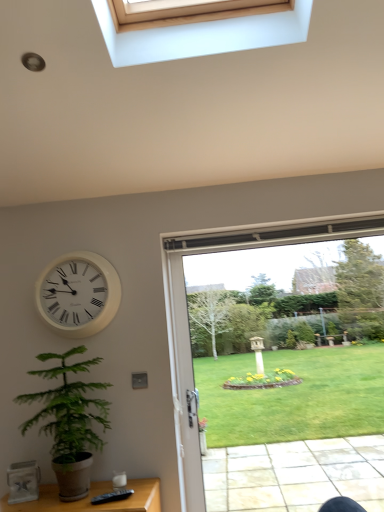
Where is `green leafy plant at lower left`? Image resolution: width=384 pixels, height=512 pixels. green leafy plant at lower left is located at coordinates (69, 421).

Based on the photo, what is the approximate height of white plastic clock at upper left?

It is 18.72 inches.

This screenshot has width=384, height=512. In order to click on green leafy plant at lower left in this screenshot , I will do `click(69, 421)`.

Is clear glass door at center a part of green leafy plant at lower left?

No, clear glass door at center is not inside green leafy plant at lower left.

Between green leafy plant at lower left and clear glass door at center, which one is positioned behind?

clear glass door at center is further from the camera.

Who is shorter, green leafy plant at lower left or clear glass door at center?

green leafy plant at lower left.

From a real-world perspective, is green leafy plant at lower left below clear glass door at center?

Indeed, from a real-world perspective, green leafy plant at lower left is positioned beneath clear glass door at center.

Considering the positions of objects clear glass door at center and green leafy plant at lower left in the image provided, who is more to the right, clear glass door at center or green leafy plant at lower left?

From the viewer's perspective, clear glass door at center appears more on the right side.

Would you consider clear glass door at center to be distant from green leafy plant at lower left?

clear glass door at center is near green leafy plant at lower left, not far away.

Is clear glass door at center facing towards green leafy plant at lower left?

No.

What's the angular difference between clear glass door at center and green leafy plant at lower left's facing directions?

The facing directions of clear glass door at center and green leafy plant at lower left are 1.2 degrees apart.

Considering the relative sizes of green leafy plant at lower left and white plastic clock at upper left in the image provided, is green leafy plant at lower left shorter than white plastic clock at upper left?

No, green leafy plant at lower left is not shorter than white plastic clock at upper left.

Is green leafy plant at lower left placed right next to white plastic clock at upper left?

No, green leafy plant at lower left is not beside white plastic clock at upper left.

In the scene shown: Is green leafy plant at lower left completely or partially outside of white plastic clock at upper left?

green leafy plant at lower left is positioned outside white plastic clock at upper left.

In terms of width, does green leafy plant at lower left look wider or thinner when compared to white plastic clock at upper left?

In the image, green leafy plant at lower left appears to be wider than white plastic clock at upper left.

In the scene shown: From a real-world perspective, is white plastic clock at upper left physically located above or below clear glass door at center?

Clearly, from a real-world perspective, white plastic clock at upper left is above clear glass door at center.

The image size is (384, 512). Find the location of `window in front of the white plastic clock at upper left`. window in front of the white plastic clock at upper left is located at coordinates (186, 312).

Considering the sizes of white plastic clock at upper left and clear glass door at center in the image, is white plastic clock at upper left wider or thinner than clear glass door at center?

In the image, white plastic clock at upper left appears to be wider than clear glass door at center.

Which is more to the left, white plastic clock at upper left or clear glass door at center?

white plastic clock at upper left is more to the left.

How much distance is there between white plastic clock at upper left and green leafy plant at lower left?

14.63 inches.

Can you tell me how much white plastic clock at upper left and green leafy plant at lower left differ in facing direction?

The angular difference between white plastic clock at upper left and green leafy plant at lower left is 1.8 degrees.

Is green leafy plant at lower left at the back of white plastic clock at upper left?

No, white plastic clock at upper left's orientation is not away from green leafy plant at lower left.

Can you confirm if white plastic clock at upper left is shorter than green leafy plant at lower left?

Indeed, white plastic clock at upper left has a lesser height compared to green leafy plant at lower left.

Is clear glass door at center further to the viewer compared to white plastic clock at upper left?

No, the depth of clear glass door at center is less than that of white plastic clock at upper left.

From a real-world perspective, is clear glass door at center located higher than white plastic clock at upper left?

No, from a real-world perspective, clear glass door at center is not over white plastic clock at upper left

Considering the sizes of clear glass door at center and white plastic clock at upper left in the image, is clear glass door at center bigger or smaller than white plastic clock at upper left?

Clearly, clear glass door at center is larger in size than white plastic clock at upper left.

Where is `houseplant located below the clear glass door at center (from the image's perspective)`? houseplant located below the clear glass door at center (from the image's perspective) is located at coordinates (69, 421).

This screenshot has height=512, width=384. Identify the location of window above the green leafy plant at lower left (from a real-world perspective). (186, 312).

Based on the photo, considering their positions, is white plastic clock at upper left positioned closer to green leafy plant at lower left than clear glass door at center?

Among the two, white plastic clock at upper left is located nearer to green leafy plant at lower left.

When comparing their distances from white plastic clock at upper left, does clear glass door at center or green leafy plant at lower left seem closer?

Among the two, green leafy plant at lower left is located nearer to white plastic clock at upper left.

Based on their spatial positions, is white plastic clock at upper left or green leafy plant at lower left closer to clear glass door at center?

white plastic clock at upper left.

Which object lies nearer to the anchor point white plastic clock at upper left, green leafy plant at lower left or clear glass door at center?

green leafy plant at lower left lies closer to white plastic clock at upper left than the other object.

Considering their positions, is green leafy plant at lower left positioned closer to clear glass door at center than white plastic clock at upper left?

white plastic clock at upper left.

From the image, which object appears to be nearer to green leafy plant at lower left, clear glass door at center or white plastic clock at upper left?

Based on the image, white plastic clock at upper left appears to be nearer to green leafy plant at lower left.

This screenshot has height=512, width=384. What are the coordinates of `houseplant situated between white plastic clock at upper left and clear glass door at center from left to right` in the screenshot? It's located at (69, 421).